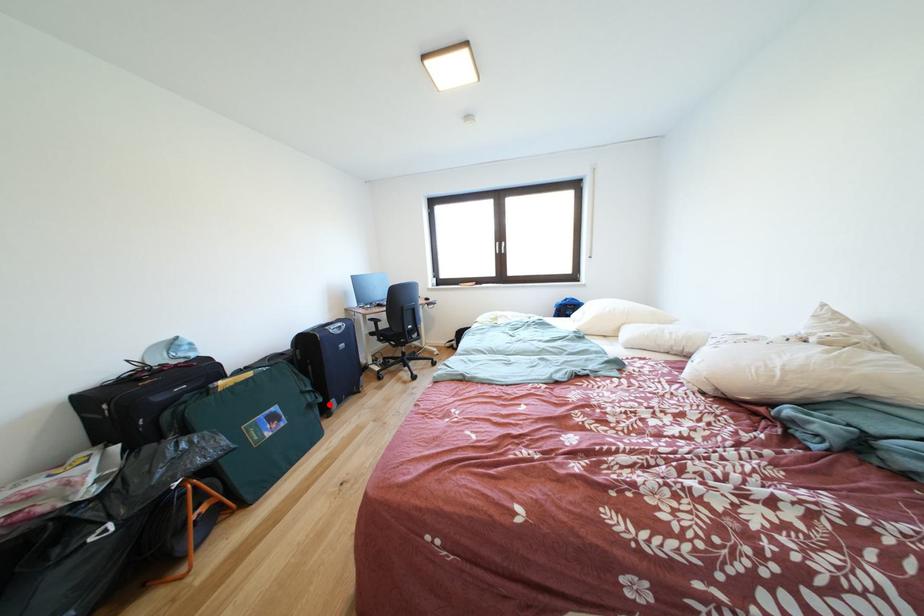
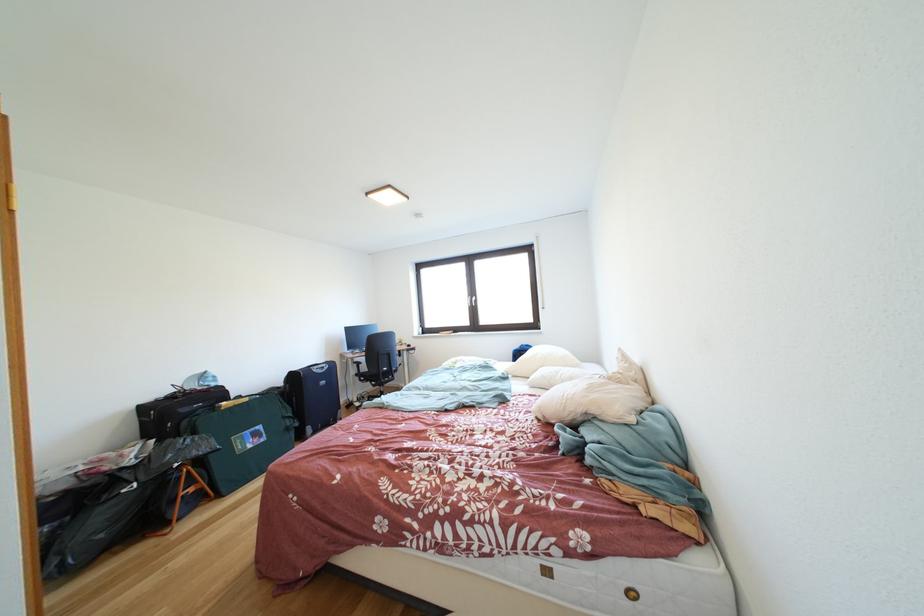
Question: I am providing you with two images of the same scene from different viewpoints. Given a red point in image1, look at the same physical point in image2. Is it:

Choices:
 (A) Closer to the viewpoint
 (B) Farther from the viewpoint

Answer: (B)